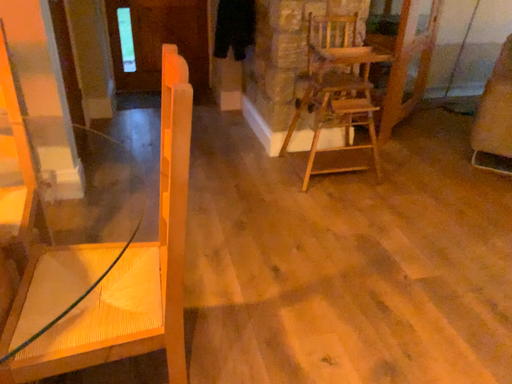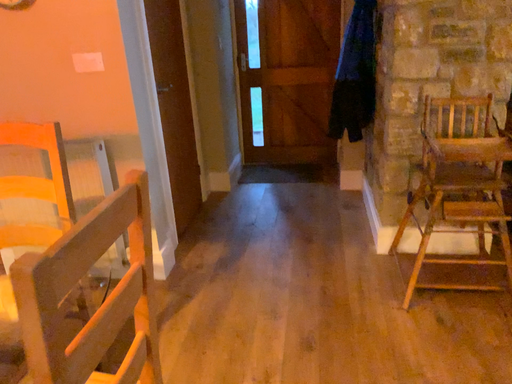
Question: Which way did the camera rotate in the video?

Choices:
 (A) rotated right
 (B) rotated left

Answer: (B)